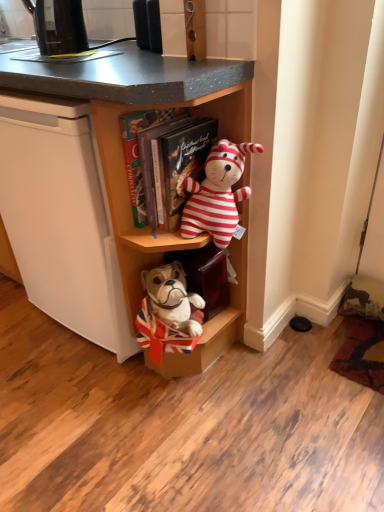
Identify the location of vacant region under black plastic kettle at upper left (from a real-world perspective). (76, 51).